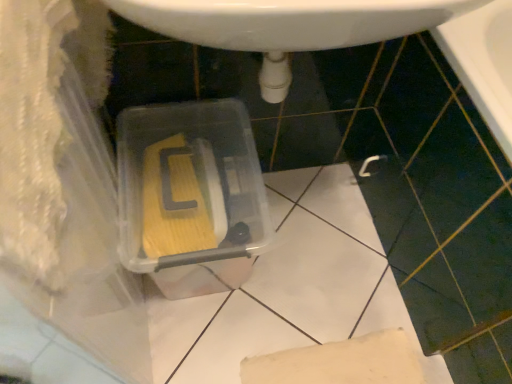
Identify the location of free location above transparent plastic storage box at center (from a real-world perspective). Image resolution: width=512 pixels, height=384 pixels. (188, 190).